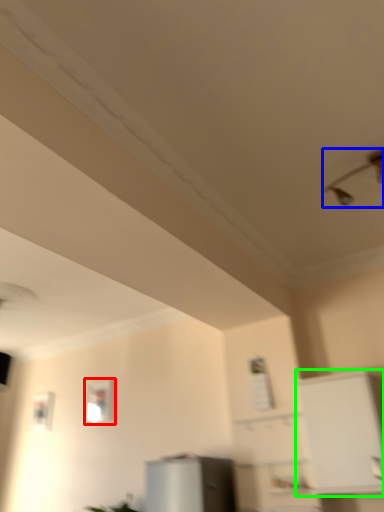
Question: Estimate the real-world distances between objects in this image. Which object is closer to window (highlighted by a red box), light fixture (highlighted by a blue box) or cabinetry (highlighted by a green box)?

Choices:
 (A) light fixture
 (B) cabinetry

Answer: (B)